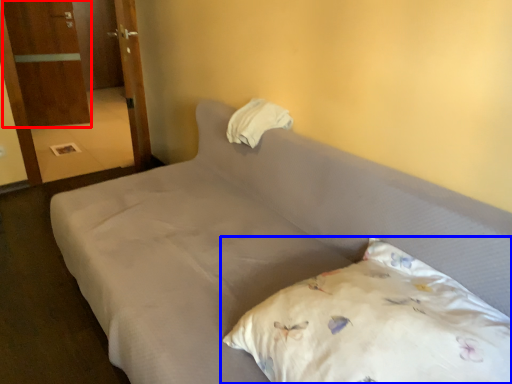
Question: Which point is closer to the camera, armoire (highlighted by a red box) or pillow (highlighted by a blue box)?

Choices:
 (A) armoire
 (B) pillow

Answer: (B)